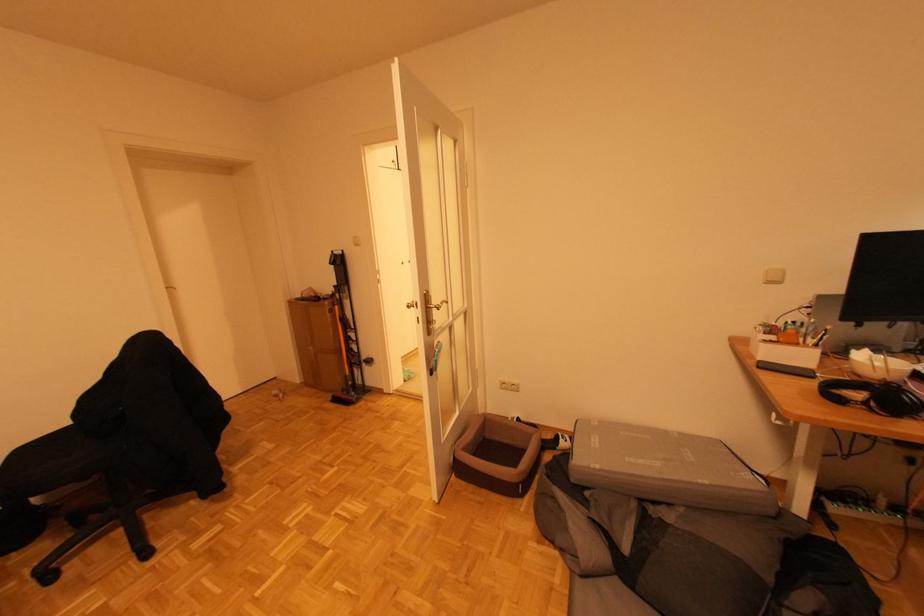
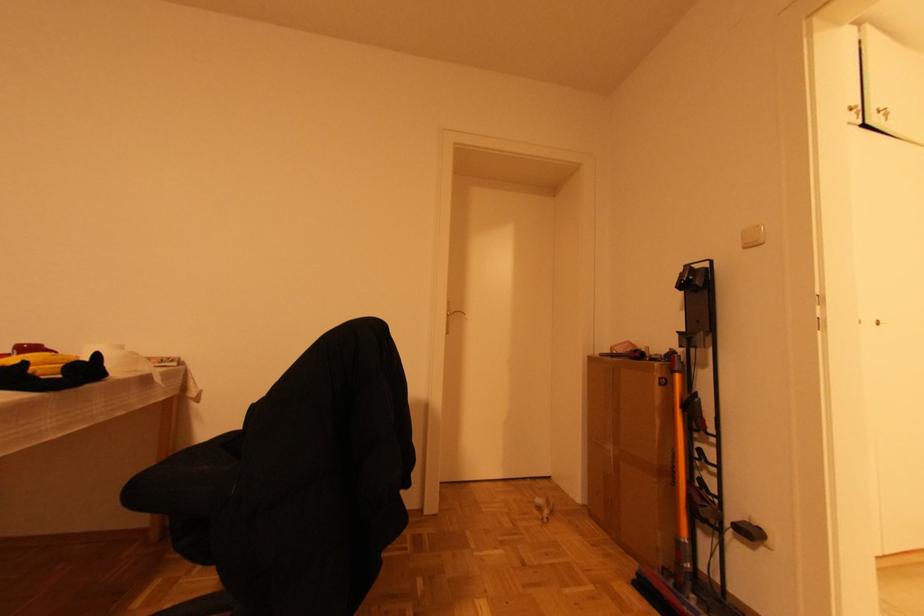
In the second image, find the point that corresponds to the point at 175,289 in the first image.

(464, 313)